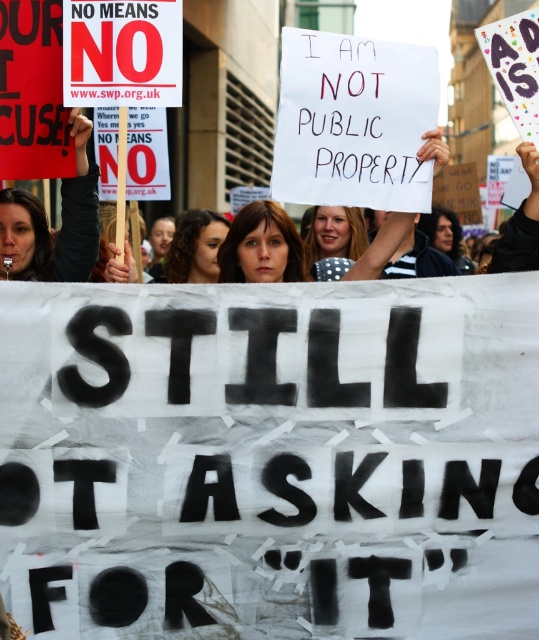
Question: Which object is the closest to the red paper sign at upper left?

Choices:
 (A) white paper sign at center
 (B) blonde hair at center
 (C) curly brown hair at center

Answer: (B)

Question: Is red paper sign at upper left smaller than matte brown hair at center?

Choices:
 (A) no
 (B) yes

Answer: (B)

Question: Is red paper sign at upper left smaller than matte brown hair at center?

Choices:
 (A) yes
 (B) no

Answer: (A)

Question: Which is farther from the matte brown hair at center?

Choices:
 (A) white paper sign at center
 (B) curly brown hair at center

Answer: (A)

Question: Which point is closer to the camera taking this photo?

Choices:
 (A) [10, 221]
 (B) [178, 227]

Answer: (A)

Question: Can you confirm if matte brown hair at center is positioned to the right of curly brown hair at center?

Choices:
 (A) no
 (B) yes

Answer: (B)